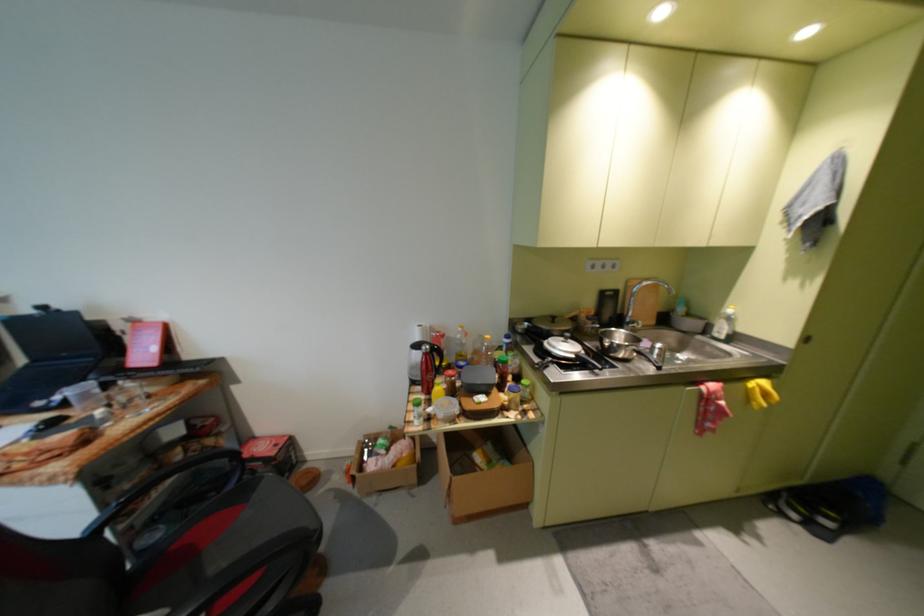
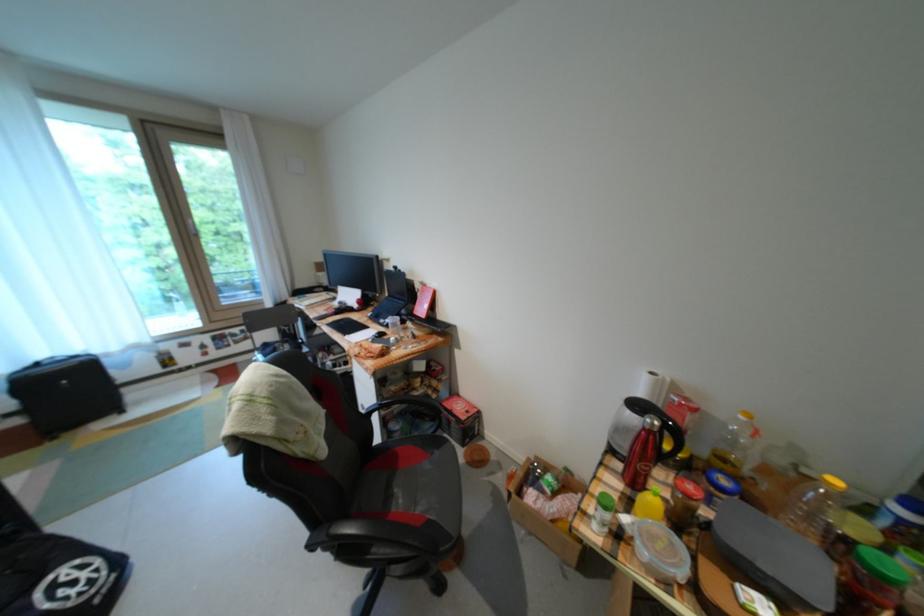
Locate, in the second image, the point that corresponds to point (458, 426) in the first image.

(664, 582)